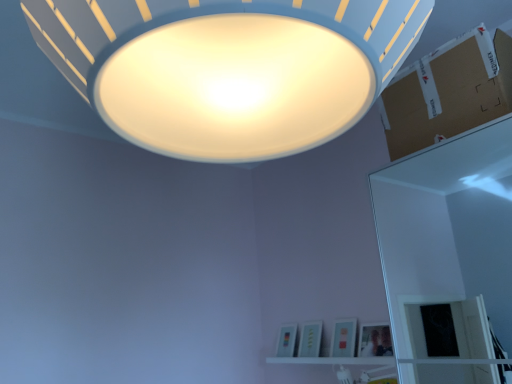
Question: Would you say white matte lampshade at upper center is outside brown cardboard at upper right?

Choices:
 (A) yes
 (B) no

Answer: (A)

Question: Does white matte lampshade at upper center contain brown cardboard at upper right?

Choices:
 (A) yes
 (B) no

Answer: (B)

Question: Considering the relative sizes of white matte lampshade at upper center and brown cardboard at upper right in the image provided, is white matte lampshade at upper center shorter than brown cardboard at upper right?

Choices:
 (A) yes
 (B) no

Answer: (B)

Question: Considering the relative positions of white matte lampshade at upper center and brown cardboard at upper right in the image provided, is white matte lampshade at upper center to the right of brown cardboard at upper right from the viewer's perspective?

Choices:
 (A) yes
 (B) no

Answer: (B)

Question: Is white matte lampshade at upper center positioned behind brown cardboard at upper right?

Choices:
 (A) yes
 (B) no

Answer: (B)

Question: Does white matte lampshade at upper center appear on the left side of brown cardboard at upper right?

Choices:
 (A) no
 (B) yes

Answer: (B)

Question: Does white matte lampshade at upper center have a lesser width compared to white glossy shelf at lower center?

Choices:
 (A) yes
 (B) no

Answer: (B)

Question: Could you tell me if white matte lampshade at upper center is turned towards white glossy shelf at lower center?

Choices:
 (A) yes
 (B) no

Answer: (B)

Question: From the image's perspective, would you say white matte lampshade at upper center is positioned over white glossy shelf at lower center?

Choices:
 (A) no
 (B) yes

Answer: (B)

Question: Is white matte lampshade at upper center located outside white glossy shelf at lower center?

Choices:
 (A) yes
 (B) no

Answer: (A)

Question: Is white matte lampshade at upper center bigger than white glossy shelf at lower center?

Choices:
 (A) no
 (B) yes

Answer: (B)

Question: Is white matte lampshade at upper center smaller than white glossy shelf at lower center?

Choices:
 (A) yes
 (B) no

Answer: (B)

Question: Is brown cardboard at upper right oriented towards white glossy shelf at lower center?

Choices:
 (A) yes
 (B) no

Answer: (B)